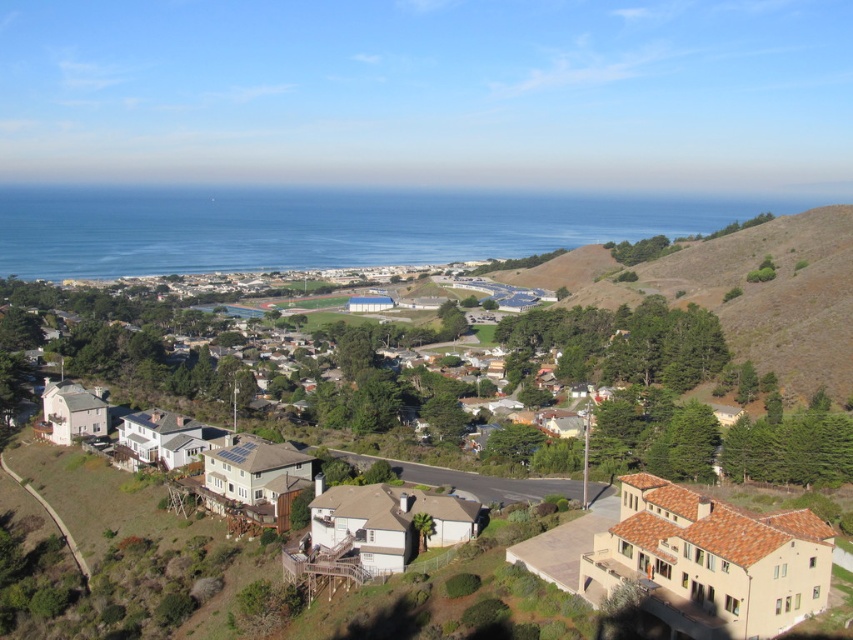
Question: Does blue water at center appear over beige stucco houses at center?

Choices:
 (A) no
 (B) yes

Answer: (B)

Question: Can you confirm if brown grassy hillside at center-right is positioned below beige stucco houses at center?

Choices:
 (A) yes
 (B) no

Answer: (B)

Question: Based on their relative distances, which object is farther from the beige stucco houses at center?

Choices:
 (A) blue water at center
 (B) brown grassy hillside at center-right

Answer: (A)

Question: Which point is closer to the camera taking this photo?

Choices:
 (A) (677, 236)
 (B) (724, 540)

Answer: (B)

Question: Which point appears closest to the camera in this image?

Choices:
 (A) (190, 490)
 (B) (335, 236)
 (C) (793, 252)

Answer: (A)

Question: In this image, where is blue water at center located relative to beige stucco houses at center?

Choices:
 (A) below
 (B) above

Answer: (B)